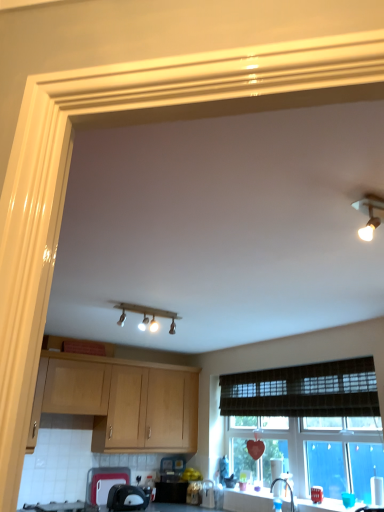
Question: Based on their positions, is black plastic toaster at lower center, which is counted as the third appliance, starting from the right, located to the left or right of metallic silver toaster at lower center, which is the 2th appliance from right to left?

Choices:
 (A) right
 (B) left

Answer: (B)

Question: Would you say black plastic toaster at lower center, which is counted as the third appliance, starting from the right, is inside or outside metallic silver toaster at lower center, the 3th appliance viewed from the left?

Choices:
 (A) outside
 (B) inside

Answer: (A)

Question: Which object is the farthest from the brown woven curtain at lower center?

Choices:
 (A) metallic silver toaster at lower center, the 4th appliance in the left-to-right sequence
 (B) light wood cabinet at upper left
 (C) black glass gas stove at lower left
 (D) matte wood light fixture at upper center
 (E) matte plastic cutting board at lower left, acting as the fourth appliance starting from the right

Answer: (C)

Question: Which is farther from the black glass gas stove at lower left?

Choices:
 (A) light wood cabinet at upper left
 (B) matte plastic cutting board at lower left, acting as the fourth appliance starting from the right
 (C) black plastic toaster at lower center, the second appliance in the left-to-right sequence
 (D) brown woven curtain at lower center
 (E) metallic silver toaster at lower center, the 4th appliance in the left-to-right sequence

Answer: (D)